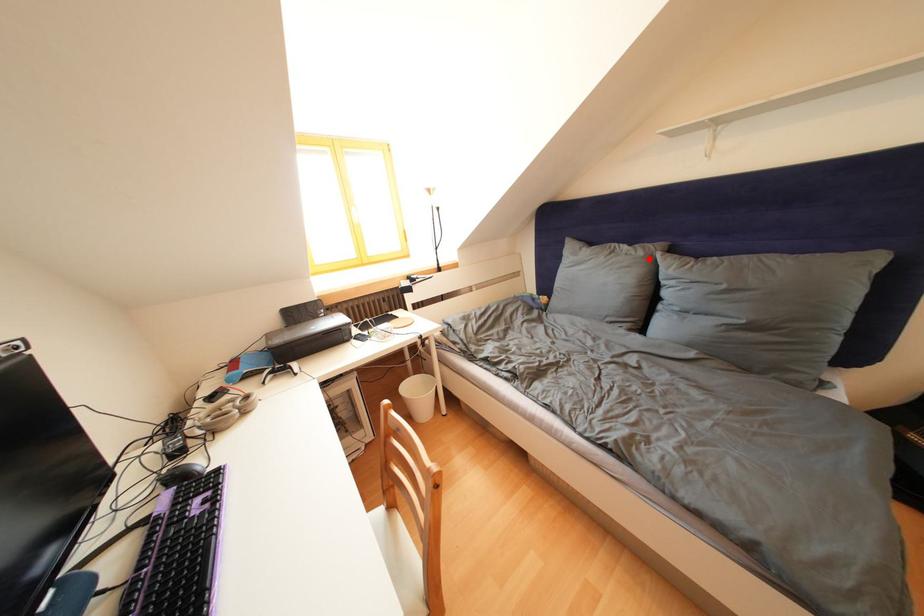
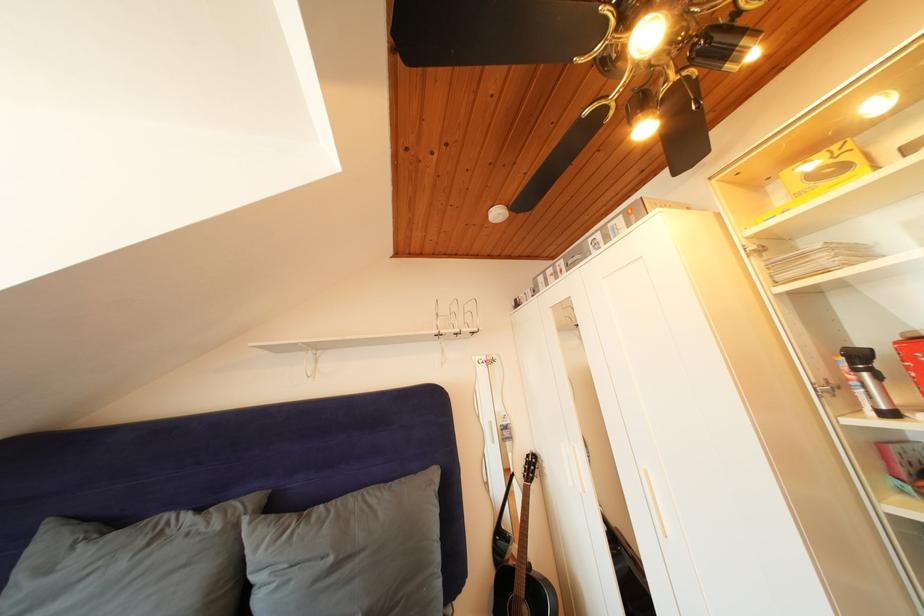
The point at the highlighted location is marked in the first image. Where is the corresponding point in the second image?

(225, 531)